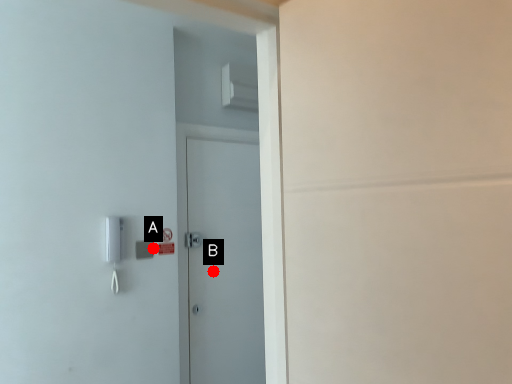
Question: Two points are circled on the image, labeled by A and B beside each circle. Which point is further to the camera?

Choices:
 (A) A is further
 (B) B is further

Answer: (B)